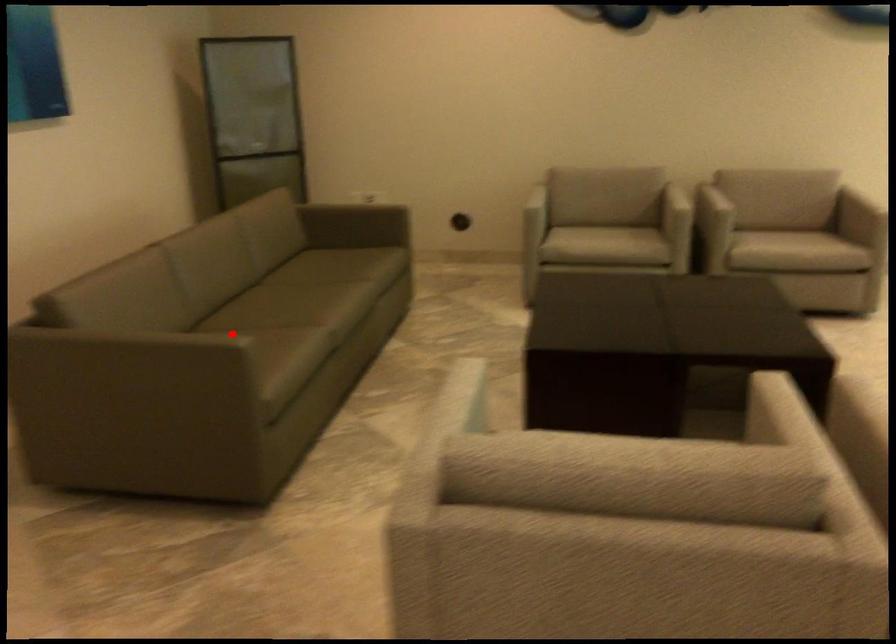
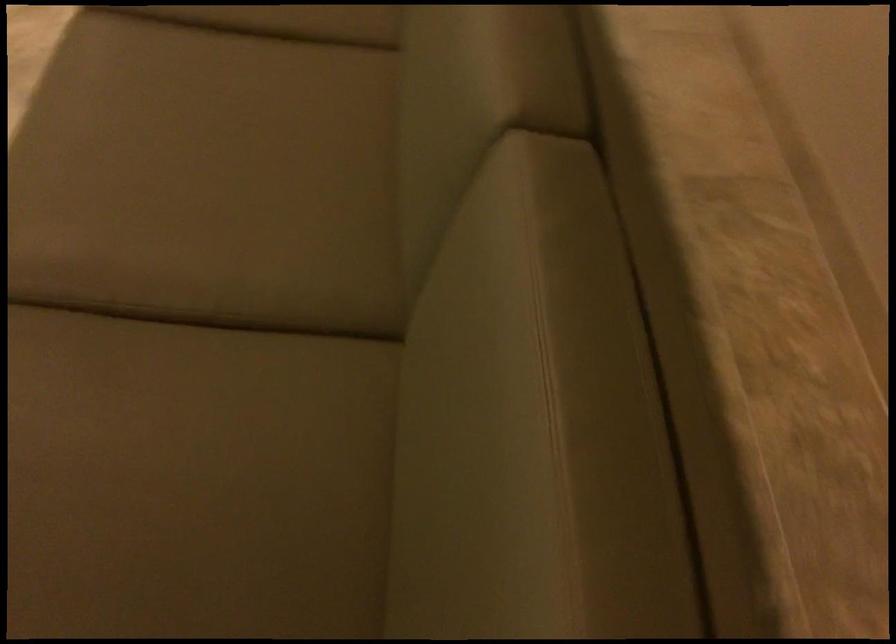
Question: I am providing you with two images of the same scene from different viewpoints. Image1 has a red point marked. In image2, the corresponding 3D location appears at what relative position? Reply with the corresponding letter.

Choices:
 (A) Closer
 (B) Farther

Answer: (A)